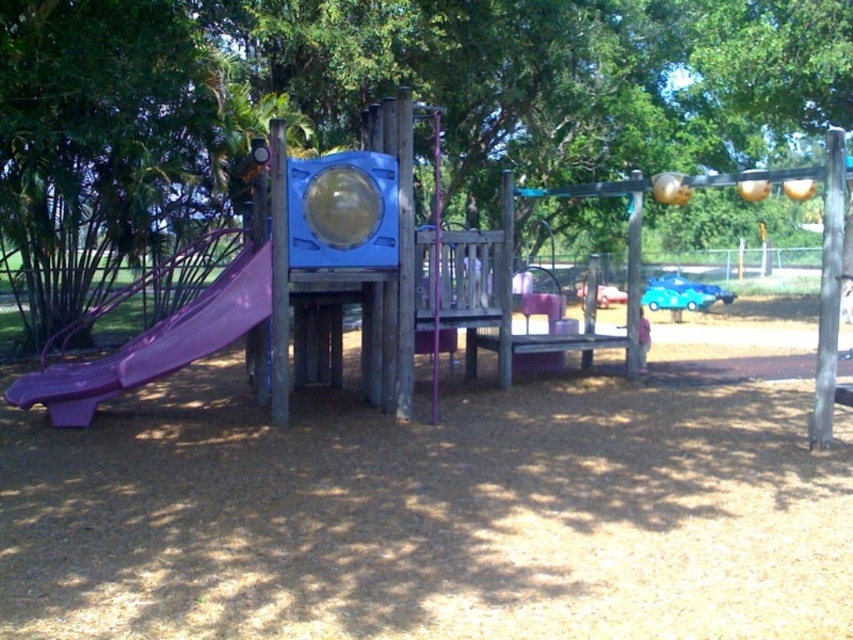
You are standing at the base of the purple slide on the left side of the playground. Looking up, you notice a point marked at coordinates (393, 88). What object is located at that point?

The point at coordinates (393, 88) marks the location of the green leafy tree at upper center.

You are a parent trying to ensure your child stays within the playground area. The green leafy tree at upper center and the pink plastic child at center are visible. Which object is taller?

The green leafy tree at upper center is much taller than the pink plastic child at center.

You are a child trying to reach the purple plastic slide at left from the green leafy tree at upper center. Which object is closer to you when you start moving forward?

The green leafy tree at upper center is closer to you because it is positioned further to the viewer than the purple plastic slide at left, meaning you are already near the tree and need to move away from it to reach the slide.